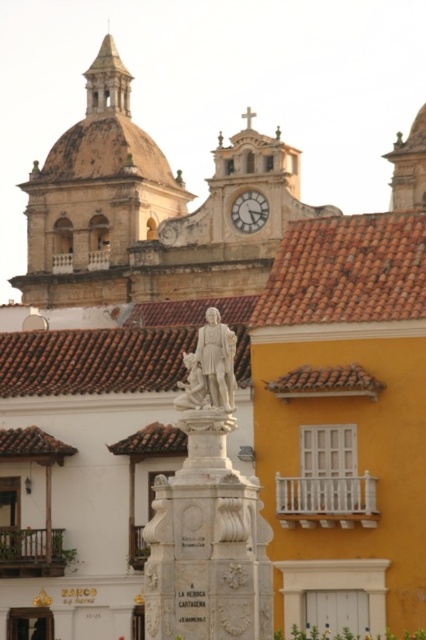
You are an architect visiting the city and want to take a photo of both the brown stone dome at upper center and the white marble clock at upper center. Which object should you focus on first to ensure both are in frame?

You should focus on the brown stone dome at upper center first because it is much taller than the white marble clock at upper center, so positioning the camera to include its full height will naturally include the shorter clock in the frame as well.

You are an architect analyzing the colonial cityscape. You notice the brown stone dome at upper center and the white marble clock at upper center. Which of these two structures has a greater width?

The brown stone dome at upper center has a greater width than the white marble clock at upper center according to the description.